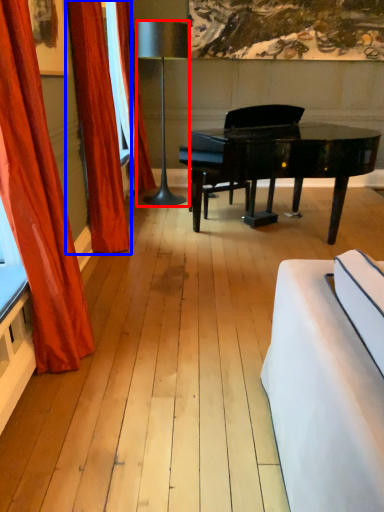
Question: Among these objects, which one is nearest to the camera, lamp (highlighted by a red box) or curtain (highlighted by a blue box)?

Choices:
 (A) lamp
 (B) curtain

Answer: (B)